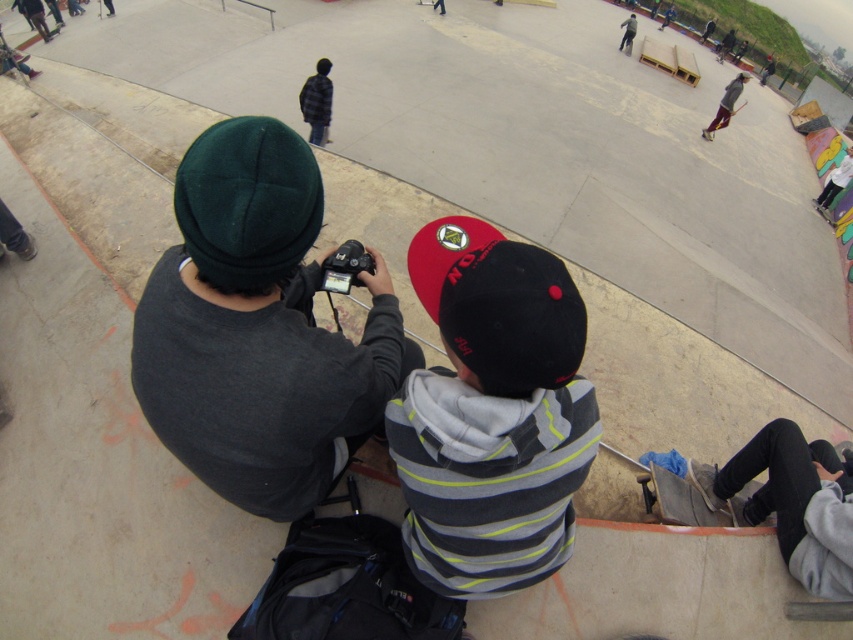
You are a photographer at the skate park and you want to capture a photo of the wooden skateboard at lower right without the dark gray fleece at left blocking the view. Can you adjust your position to do so?

The dark gray fleece at left is positioned over the wooden skateboard at lower right, so moving your position to the right or left might allow you to capture the wooden skateboard at lower right without obstruction.